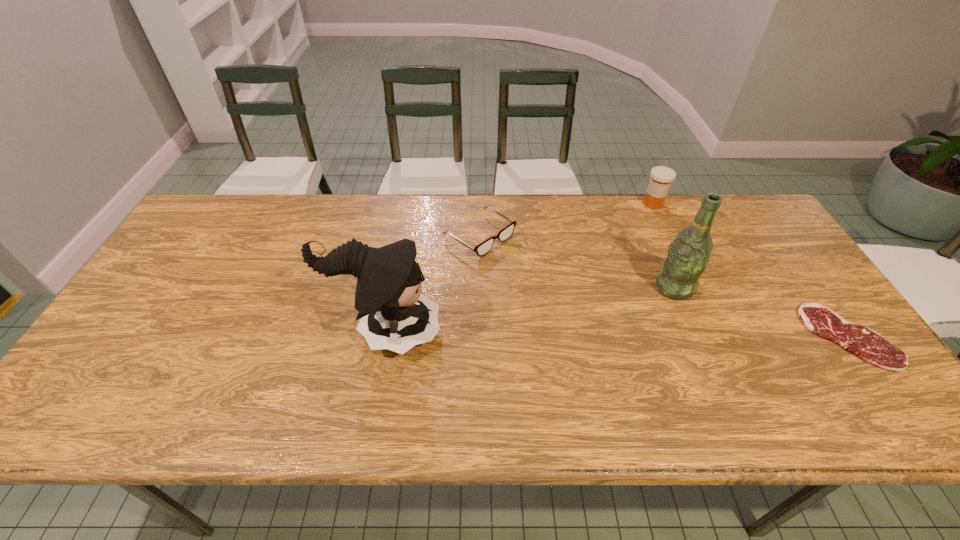
This screenshot has width=960, height=540. I want to click on spectacles that is at the far edge, so click(x=483, y=248).

At what (x,y) coordinates should I click in order to perform the action: click on doll that is at the near edge. Please return your answer as a coordinate pair (x, y). This screenshot has width=960, height=540. Looking at the image, I should click on (394, 314).

Find the location of a particular element. steak at the near edge is located at coordinates (867, 344).

This screenshot has height=540, width=960. I want to click on object located in the right edge section of the desktop, so click(x=867, y=344).

Find the location of a particular element. The width and height of the screenshot is (960, 540). object that is positioned at the near right corner is located at coordinates (867, 344).

Image resolution: width=960 pixels, height=540 pixels. In order to click on free space at the far edge in this screenshot , I will do `click(566, 210)`.

Locate an element on the screen. Image resolution: width=960 pixels, height=540 pixels. vacant space at the near edge of the desktop is located at coordinates (658, 366).

Where is `vacant space at the left edge of the desktop`? vacant space at the left edge of the desktop is located at coordinates (210, 258).

In the image, there is a desktop. Where is `vacant space at the far left corner`? Image resolution: width=960 pixels, height=540 pixels. vacant space at the far left corner is located at coordinates (245, 222).

Image resolution: width=960 pixels, height=540 pixels. Find the location of `vacant space at the far right corner`. vacant space at the far right corner is located at coordinates (774, 238).